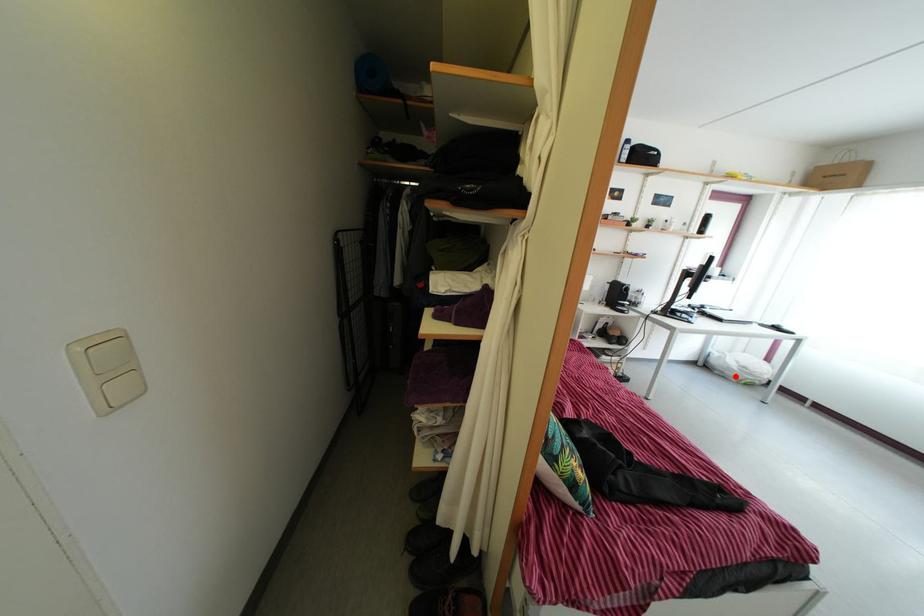
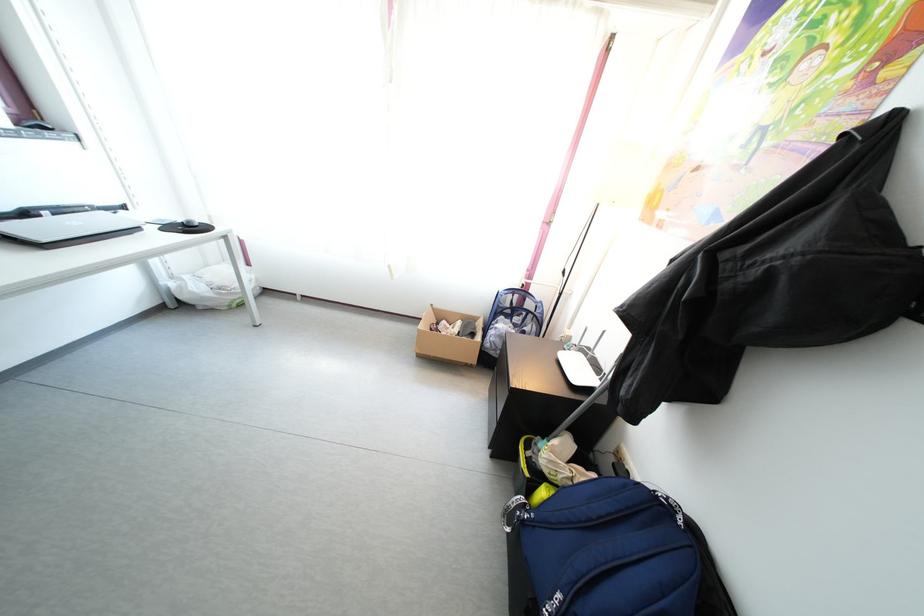
Question: I am providing you with two images of the same scene from different viewpoints. A red point is marked on the first image. Can you still see the location of the red point in image 2?

Choices:
 (A) Yes
 (B) No

Answer: (A)